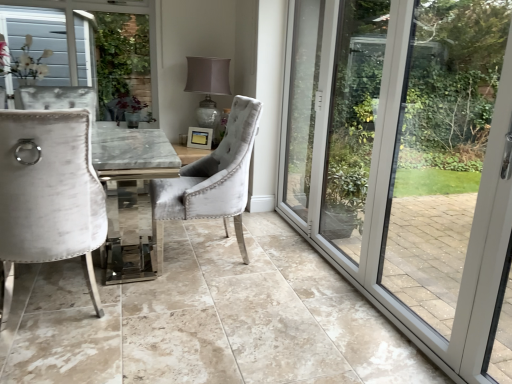
Question: Does matte silver lamp at center have a greater height compared to transparent glass door at right?

Choices:
 (A) no
 (B) yes

Answer: (A)

Question: From a real-world perspective, is matte silver lamp at center located higher than transparent glass door at right?

Choices:
 (A) yes
 (B) no

Answer: (A)

Question: Considering the relative sizes of matte silver lamp at center and transparent glass door at right in the image provided, is matte silver lamp at center smaller than transparent glass door at right?

Choices:
 (A) no
 (B) yes

Answer: (B)

Question: From the image's perspective, would you say matte silver lamp at center is positioned over transparent glass door at right?

Choices:
 (A) yes
 (B) no

Answer: (A)

Question: Considering the relative positions of matte silver lamp at center and transparent glass door at right in the image provided, is matte silver lamp at center in front of transparent glass door at right?

Choices:
 (A) no
 (B) yes

Answer: (A)

Question: In terms of width, does velvet grey chair at center, acting as the second chair starting from the left, look wider or thinner when compared to velvet white chair at left, acting as the second chair starting from the right?

Choices:
 (A) wide
 (B) thin

Answer: (A)

Question: From the image's perspective, is velvet grey chair at center, which is counted as the first chair, starting from the right, above or below velvet white chair at left, acting as the second chair starting from the right?

Choices:
 (A) below
 (B) above

Answer: (B)

Question: Visually, is velvet grey chair at center, which is counted as the first chair, starting from the right, positioned to the left or to the right of velvet white chair at left, placed as the 1th chair when sorted from left to right?

Choices:
 (A) right
 (B) left

Answer: (A)

Question: Is velvet grey chair at center, which is counted as the first chair, starting from the right, situated inside velvet white chair at left, placed as the 1th chair when sorted from left to right, or outside?

Choices:
 (A) outside
 (B) inside

Answer: (A)

Question: Considering the positions of point (309, 190) and point (252, 130), is point (309, 190) closer or farther from the camera than point (252, 130)?

Choices:
 (A) farther
 (B) closer

Answer: (A)

Question: Which is correct: transparent glass door at right is inside velvet grey chair at center, which is counted as the first chair, starting from the right, or outside of it?

Choices:
 (A) inside
 (B) outside

Answer: (B)

Question: From a real-world perspective, is transparent glass door at right above or below velvet grey chair at center, acting as the second chair starting from the left?

Choices:
 (A) above
 (B) below

Answer: (A)

Question: Based on their sizes in the image, would you say transparent glass door at right is bigger or smaller than velvet grey chair at center, acting as the second chair starting from the left?

Choices:
 (A) big
 (B) small

Answer: (B)

Question: Which is correct: white textured fabric at upper left is inside velvet grey chair at center, which is counted as the first chair, starting from the right, or outside of it?

Choices:
 (A) outside
 (B) inside

Answer: (A)

Question: From the image's perspective, is white textured fabric at upper left above or below velvet grey chair at center, acting as the second chair starting from the left?

Choices:
 (A) above
 (B) below

Answer: (A)